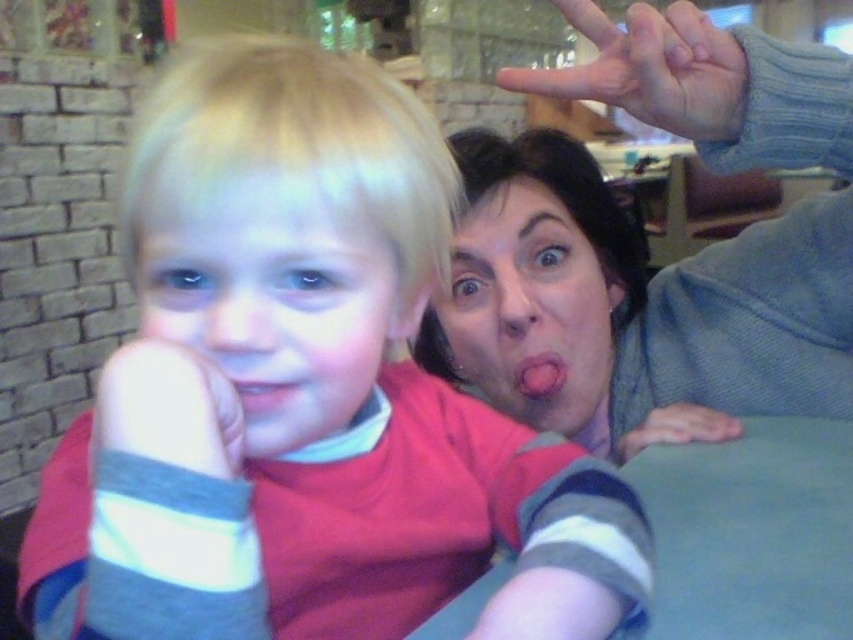
Is matte pink face at center to the right of smooth gray hand at upper right from the viewer's perspective?

No, matte pink face at center is not to the right of smooth gray hand at upper right.

Is point (587, 387) closer to viewer compared to point (640, 49)?

No, (587, 387) is further to viewer.

What do you see at coordinates (529, 308) in the screenshot? I see `matte pink face at center` at bounding box center [529, 308].

I want to click on matte pink face at center, so click(x=529, y=308).

Who is taller, blonde hair at center or matte pink face at center?

matte pink face at center

Which is in front, point (138, 285) or point (514, 360)?

Point (138, 285) is more forward.

Find the location of a particular element. This screenshot has width=853, height=640. blonde hair at center is located at coordinates (271, 298).

Can you confirm if smooth gray hand at lower right is wider than pink matte tongue at center?

Indeed, smooth gray hand at lower right has a greater width compared to pink matte tongue at center.

Is smooth gray hand at lower right positioned at the back of pink matte tongue at center?

No, smooth gray hand at lower right is in front of pink matte tongue at center.

Which is in front, point (621, 449) or point (518, 374)?

Point (621, 449) is in front.

Find the location of a particular element. The width and height of the screenshot is (853, 640). smooth gray hand at lower right is located at coordinates tap(677, 428).